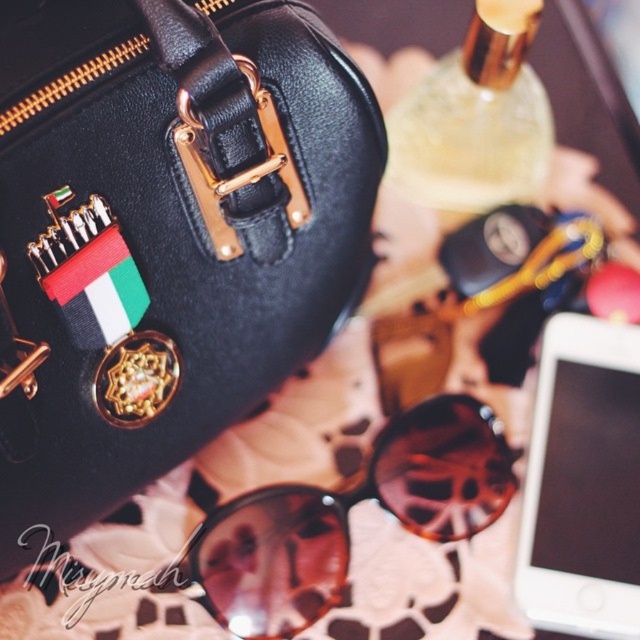
You are an interior designer planning to place the black leather handbag at upper left and the brown matte sunglasses at center on a shelf. The shelf has a height limit of 15 cm. Can both items fit vertically without exceeding the height limit?

The black leather handbag at upper left has a greater height compared to the brown matte sunglasses at center. Since the handbag is taller, if its height is under 15 cm, both can fit. However, if the handbag exceeds 15 cm, it won

You are organizing a display of accessories and need to ensure that the black leather handbag at upper left doesn not block the view of the white matte smartphone at lower right. Can you confirm if the handbag is currently obscuring the smartphone?

The black leather handbag at upper left is positioned over white matte smartphone at lower right, so yes, the handbag is currently obscuring the smartphone.

You are trying to place both the brown matte sunglasses at center and the white matte smartphone at lower right into a small pouch that can only fit items smaller than the smartphone. Which item cannot fit into the pouch?

The brown matte sunglasses at center cannot fit into the pouch because it is larger in size than the white matte smartphone at lower right, which is the size limit for the pouch.